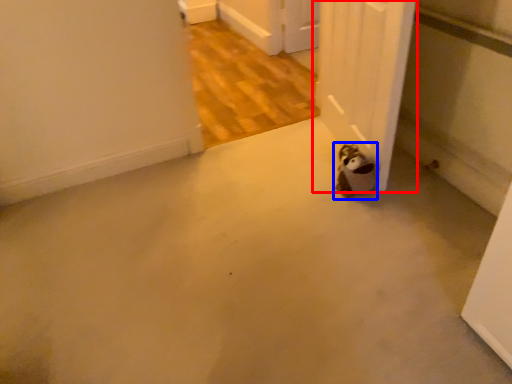
Question: Which object is further to the camera taking this photo, door (highlighted by a red box) or animal (highlighted by a blue box)?

Choices:
 (A) door
 (B) animal

Answer: (B)